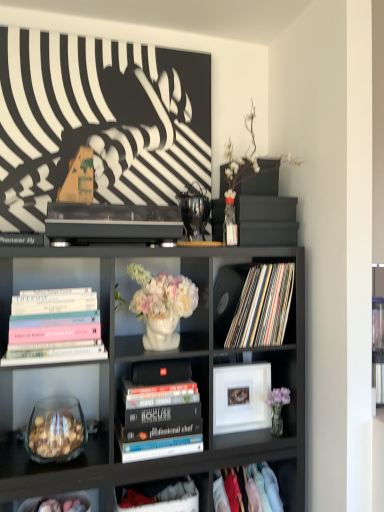
Question: Is hardcover books at center, the 2th book positioned from the right, taller or shorter than black matte speaker at center?

Choices:
 (A) short
 (B) tall

Answer: (B)

Question: Do you think hardcover books at center, which ranks as the third book in top-to-bottom order, is within black matte speaker at center, or outside of it?

Choices:
 (A) inside
 (B) outside

Answer: (B)

Question: Estimate the real-world distances between objects in this image. Which object is farther from the pink glass vase at lower right?

Choices:
 (A) pastel hardcover books at left, the 2th book when ordered from top to bottom
 (B) black matte speaker at center
 (C) matte vinyl records at center, positioned as the 3th book in left-to-right order
 (D) hardcover books at center, arranged as the 2th book when viewed from the left
 (E) cloth at lower right, which appears as the first shelf when viewed from the right

Answer: (A)

Question: Which is farther from the matte black bookcase at center?

Choices:
 (A) matte white picture frame at center
 (B) hardcover books at center, arranged as the 2th book when viewed from the left
 (C) pastel hardcover books at left, the second book from the bottom
 (D) matte vinyl records at center, which is the first book from top to bottom
 (E) pink glass vase at lower right

Answer: (E)